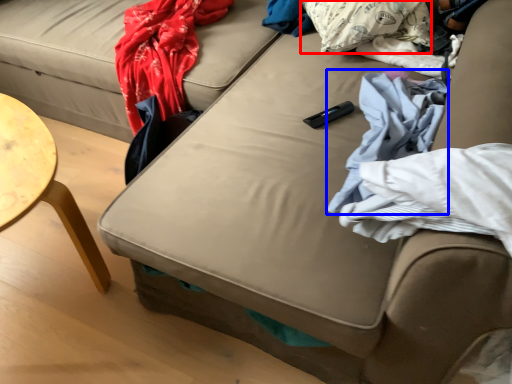
Question: Which object appears farthest to the camera in this image, pillow (highlighted by a red box) or material (highlighted by a blue box)?

Choices:
 (A) pillow
 (B) material

Answer: (A)